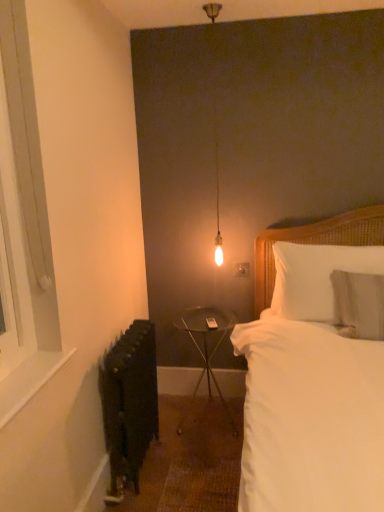
Question: Is black matte radiator at lower left completely or partially outside of metallic silver table at center?

Choices:
 (A) yes
 (B) no

Answer: (A)

Question: Is metallic silver table at center at the back of black matte radiator at lower left?

Choices:
 (A) yes
 (B) no

Answer: (B)

Question: From a real-world perspective, is black matte radiator at lower left physically below metallic silver table at center?

Choices:
 (A) yes
 (B) no

Answer: (B)

Question: Considering the relative sizes of black matte radiator at lower left and metallic silver table at center in the image provided, is black matte radiator at lower left bigger than metallic silver table at center?

Choices:
 (A) yes
 (B) no

Answer: (B)

Question: Considering the relative sizes of black matte radiator at lower left and metallic silver table at center in the image provided, is black matte radiator at lower left smaller than metallic silver table at center?

Choices:
 (A) no
 (B) yes

Answer: (B)

Question: Can you confirm if black matte radiator at lower left is taller than metallic silver table at center?

Choices:
 (A) yes
 (B) no

Answer: (A)

Question: Is white soft pillow at upper right, the 1th pillow when ordered from back to front, a part of white cotton bed at center?

Choices:
 (A) yes
 (B) no

Answer: (A)

Question: Does white cotton bed at center have a smaller size compared to white soft pillow at upper right, the 1th pillow when ordered from back to front?

Choices:
 (A) yes
 (B) no

Answer: (B)

Question: Is white cotton bed at center to the left of white soft pillow at upper right, arranged as the 2th pillow when viewed from the front, from the viewer's perspective?

Choices:
 (A) yes
 (B) no

Answer: (A)

Question: From the image's perspective, would you say white cotton bed at center is positioned over white soft pillow at upper right, the 1th pillow when ordered from back to front?

Choices:
 (A) no
 (B) yes

Answer: (A)

Question: Is white cotton bed at center outside of white soft pillow at upper right, arranged as the 2th pillow when viewed from the front?

Choices:
 (A) yes
 (B) no

Answer: (A)

Question: From a real-world perspective, is white cotton bed at center over white soft pillow at upper right, arranged as the 2th pillow when viewed from the front?

Choices:
 (A) no
 (B) yes

Answer: (A)

Question: Is metallic silver table at center thinner than white cotton bed at center?

Choices:
 (A) no
 (B) yes

Answer: (B)